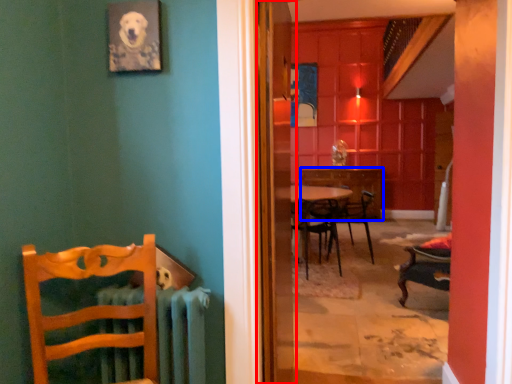
Question: Which of the following is the closest to the observer, screen door (highlighted by a red box) or desk (highlighted by a blue box)?

Choices:
 (A) screen door
 (B) desk

Answer: (A)